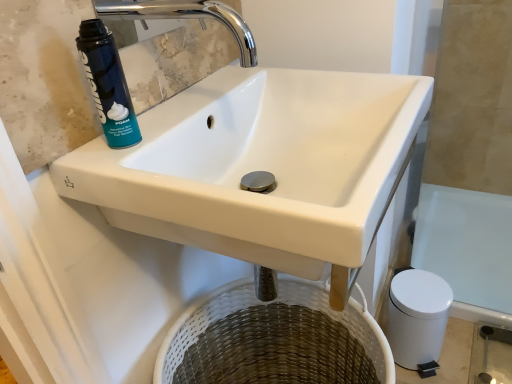
Question: Does blue matte shaving cream can at upper left have a lesser height compared to white ceramic sink at upper center?

Choices:
 (A) no
 (B) yes

Answer: (B)

Question: Considering the relative positions of blue matte shaving cream can at upper left and white ceramic sink at upper center in the image provided, is blue matte shaving cream can at upper left behind white ceramic sink at upper center?

Choices:
 (A) yes
 (B) no

Answer: (A)

Question: From a real-world perspective, does blue matte shaving cream can at upper left stand above white ceramic sink at upper center?

Choices:
 (A) no
 (B) yes

Answer: (B)

Question: From a real-world perspective, is blue matte shaving cream can at upper left below white ceramic sink at upper center?

Choices:
 (A) yes
 (B) no

Answer: (B)

Question: Is blue matte shaving cream can at upper left turned away from white ceramic sink at upper center?

Choices:
 (A) yes
 (B) no

Answer: (B)

Question: Do you think blue matte shaving cream can at upper left is within chrome metallic faucet at upper center, or outside of it?

Choices:
 (A) outside
 (B) inside

Answer: (A)

Question: Would you say blue matte shaving cream can at upper left is to the left or to the right of chrome metallic faucet at upper center in the picture?

Choices:
 (A) right
 (B) left

Answer: (B)

Question: Considering their positions, is blue matte shaving cream can at upper left located in front of or behind chrome metallic faucet at upper center?

Choices:
 (A) front
 (B) behind

Answer: (B)

Question: From the image's perspective, is blue matte shaving cream can at upper left located above or below chrome metallic faucet at upper center?

Choices:
 (A) above
 (B) below

Answer: (B)

Question: In the image, is chrome metallic faucet at upper center on the left side or the right side of white ceramic sink at upper center?

Choices:
 (A) left
 (B) right

Answer: (A)

Question: From the image's perspective, is chrome metallic faucet at upper center positioned above or below white ceramic sink at upper center?

Choices:
 (A) below
 (B) above

Answer: (B)

Question: Considering the positions of chrome metallic faucet at upper center and white ceramic sink at upper center in the image, is chrome metallic faucet at upper center bigger or smaller than white ceramic sink at upper center?

Choices:
 (A) big
 (B) small

Answer: (B)

Question: Is point (243, 51) closer or farther from the camera than point (256, 96)?

Choices:
 (A) closer
 (B) farther

Answer: (B)

Question: From a real-world perspective, is blue matte shaving cream can at upper left above or below white ceramic sink at upper center?

Choices:
 (A) above
 (B) below

Answer: (A)

Question: In terms of width, does blue matte shaving cream can at upper left look wider or thinner when compared to white ceramic sink at upper center?

Choices:
 (A) wide
 (B) thin

Answer: (B)